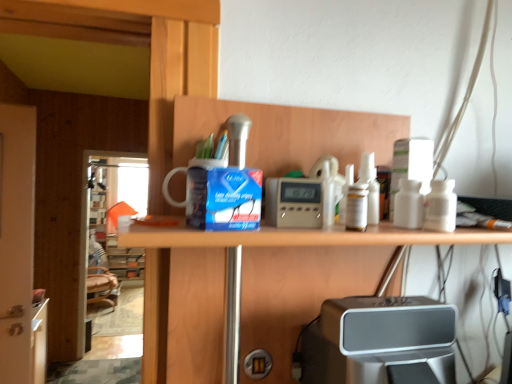
What is the approximate width of transparent glass screen door at left, arranged as the first screen door when viewed from the left?

The width of transparent glass screen door at left, arranged as the first screen door when viewed from the left, is 4.74 inches.

The height and width of the screenshot is (384, 512). In order to click on transparent glass screen door at left, the 2th screen door from the right in this screenshot , I will do (x=106, y=211).

Find the location of `silver metallic speaker at lower center`. silver metallic speaker at lower center is located at coordinates 380,341.

Would you say white glossy door at left, which is counted as the 1th screen door, starting from the front, is a long distance from transparent glass screen door at left, arranged as the first screen door when viewed from the left?

white glossy door at left, which is counted as the 1th screen door, starting from the front, is far away from transparent glass screen door at left, arranged as the first screen door when viewed from the left.

Which is in front, point (15, 353) or point (109, 199)?

Point (15, 353)

Is transparent glass screen door at left, marked as the second screen door in a front-to-back arrangement, located within white glossy door at left, which ranks as the second screen door in left-to-right order?

No, transparent glass screen door at left, marked as the second screen door in a front-to-back arrangement, is not surrounded by white glossy door at left, which ranks as the second screen door in left-to-right order.

Locate an element on the screen. The height and width of the screenshot is (384, 512). screen door lying above the transparent glass screen door at left, the 2th screen door from the right (from the image's perspective) is located at coordinates (16, 241).

Can you confirm if white glossy door at left, marked as the first screen door in a right-to-left arrangement, is bigger than matte digital clock at center?

Yes, white glossy door at left, marked as the first screen door in a right-to-left arrangement, is bigger than matte digital clock at center.

Which of these two, white glossy door at left, marked as the first screen door in a right-to-left arrangement, or matte digital clock at center, stands shorter?

Standing shorter between the two is matte digital clock at center.

In the scene shown: Is white glossy door at left, the 2th screen door positioned from the back, beside matte digital clock at center?

No, white glossy door at left, the 2th screen door positioned from the back, is not beside matte digital clock at center.

From a real-world perspective, is white glossy door at left, which ranks as the second screen door in left-to-right order, located beneath matte digital clock at center?

Correct, in the physical world, white glossy door at left, which ranks as the second screen door in left-to-right order, is lower than matte digital clock at center.

Considering the sizes of objects silver metallic speaker at lower center and matte digital clock at center in the image provided, who is smaller, silver metallic speaker at lower center or matte digital clock at center?

Smaller between the two is matte digital clock at center.

From a real-world perspective, is silver metallic speaker at lower center positioned over matte digital clock at center based on gravity?

No.

Is silver metallic speaker at lower center outside of matte digital clock at center?

silver metallic speaker at lower center lies outside matte digital clock at center's area.

From the image's perspective, is silver metallic speaker at lower center located above matte digital clock at center?

No, from the image's perspective, silver metallic speaker at lower center is not on top of matte digital clock at center.

In the scene shown: Can you tell me how much matte digital clock at center and transparent glass screen door at left, the 2th screen door from the right, differ in facing direction?

matte digital clock at center and transparent glass screen door at left, the 2th screen door from the right, are facing 90.5 degrees away from each other.

Does matte digital clock at center come behind transparent glass screen door at left, the 2th screen door from the right?

No, matte digital clock at center is closer to the camera.

At what (x,y) coordinates should I click in order to perform the action: click on appliance in front of the transparent glass screen door at left, arranged as the first screen door when viewed from the left. Please return your answer as a coordinate pair (x, y). The image size is (512, 384). Looking at the image, I should click on [293, 203].

Is matte digital clock at center bigger than transparent glass screen door at left, arranged as the first screen door when viewed from the left?

No, matte digital clock at center is not bigger than transparent glass screen door at left, arranged as the first screen door when viewed from the left.

Is point (90, 265) in front of point (426, 373)?

That is False.

Is transparent glass screen door at left, marked as the second screen door in a front-to-back arrangement, aimed at silver metallic speaker at lower center?

Yes, transparent glass screen door at left, marked as the second screen door in a front-to-back arrangement, faces towards silver metallic speaker at lower center.

From a real-world perspective, does transparent glass screen door at left, the first screen door from the back, sit lower than silver metallic speaker at lower center?

Correct, in the physical world, transparent glass screen door at left, the first screen door from the back, is lower than silver metallic speaker at lower center.

How many degrees apart are the facing directions of transparent glass screen door at left, the 2th screen door from the right, and silver metallic speaker at lower center?

transparent glass screen door at left, the 2th screen door from the right, and silver metallic speaker at lower center are facing 4.39 degrees away from each other.

From the image's perspective, who appears lower, matte digital clock at center or silver metallic speaker at lower center?

silver metallic speaker at lower center, from the image's perspective.

Could you tell me if matte digital clock at center is facing silver metallic speaker at lower center?

No, matte digital clock at center is not oriented towards silver metallic speaker at lower center.

Are matte digital clock at center and silver metallic speaker at lower center located far from each other?

That's not correct — matte digital clock at center is a little close to silver metallic speaker at lower center.

How many degrees apart are the facing directions of matte digital clock at center and silver metallic speaker at lower center?

The facing directions of matte digital clock at center and silver metallic speaker at lower center are 94.9 degrees apart.

Does transparent glass screen door at left, the 2th screen door from the right, have a greater width compared to matte digital clock at center?

Yes.

Is transparent glass screen door at left, arranged as the first screen door when viewed from the left, smaller than matte digital clock at center?

Incorrect, transparent glass screen door at left, arranged as the first screen door when viewed from the left, is not smaller in size than matte digital clock at center.

Locate an element on the screen. Image resolution: width=512 pixels, height=384 pixels. screen door behind the white glossy door at left, marked as the first screen door in a right-to-left arrangement is located at coordinates (106, 211).

From the image's perspective, count 1st screen doors downward from the matte digital clock at center and point to it. Please provide its 2D coordinates.

[(16, 241)]

Considering their positions, is matte digital clock at center positioned further to transparent glass screen door at left, the first screen door from the back, than silver metallic speaker at lower center?

Based on the image, matte digital clock at center appears to be further to transparent glass screen door at left, the first screen door from the back.

Estimate the real-world distances between objects in this image. Which object is further from silver metallic speaker at lower center, white glossy door at left, marked as the first screen door in a right-to-left arrangement, or matte digital clock at center?

white glossy door at left, marked as the first screen door in a right-to-left arrangement, lies further to silver metallic speaker at lower center than the other object.

Which object lies further to the anchor point white glossy door at left, which is counted as the 1th screen door, starting from the front, silver metallic speaker at lower center or transparent glass screen door at left, the 2th screen door from the right?

transparent glass screen door at left, the 2th screen door from the right, is positioned further to the anchor white glossy door at left, which is counted as the 1th screen door, starting from the front.

From the image, which object appears to be farther from transparent glass screen door at left, arranged as the first screen door when viewed from the left, matte digital clock at center or white glossy door at left, marked as the first screen door in a right-to-left arrangement?

matte digital clock at center is further to transparent glass screen door at left, arranged as the first screen door when viewed from the left.

Considering their positions, is silver metallic speaker at lower center positioned further to transparent glass screen door at left, marked as the second screen door in a front-to-back arrangement, than matte digital clock at center?

Based on the image, matte digital clock at center appears to be further to transparent glass screen door at left, marked as the second screen door in a front-to-back arrangement.

Estimate the real-world distances between objects in this image. Which object is closer to matte digital clock at center, transparent glass screen door at left, arranged as the first screen door when viewed from the left, or silver metallic speaker at lower center?

silver metallic speaker at lower center is closer to matte digital clock at center.

Looking at the image, which one is located closer to matte digital clock at center, white glossy door at left, the 2th screen door positioned from the back, or transparent glass screen door at left, the 2th screen door from the right?

white glossy door at left, the 2th screen door positioned from the back, is closer to matte digital clock at center.

Estimate the real-world distances between objects in this image. Which object is further from matte digital clock at center, white glossy door at left, the 2th screen door positioned from the back, or silver metallic speaker at lower center?

white glossy door at left, the 2th screen door positioned from the back, is positioned further to the anchor matte digital clock at center.

Where is `screen door between matte digital clock at center and transparent glass screen door at left, arranged as the first screen door when viewed from the left, along the z-axis`? Image resolution: width=512 pixels, height=384 pixels. screen door between matte digital clock at center and transparent glass screen door at left, arranged as the first screen door when viewed from the left, along the z-axis is located at coordinates (16, 241).

Image resolution: width=512 pixels, height=384 pixels. Find the location of `appliance between silver metallic speaker at lower center and transparent glass screen door at left, the 2th screen door from the right, in the front-back direction`. appliance between silver metallic speaker at lower center and transparent glass screen door at left, the 2th screen door from the right, in the front-back direction is located at coordinates (293, 203).

I want to click on screen door between silver metallic speaker at lower center and transparent glass screen door at left, arranged as the first screen door when viewed from the left, in the front-back direction, so click(16, 241).

Identify the location of appliance between silver metallic speaker at lower center and white glossy door at left, the 2th screen door positioned from the back, from front to back. The height and width of the screenshot is (384, 512). (293, 203).